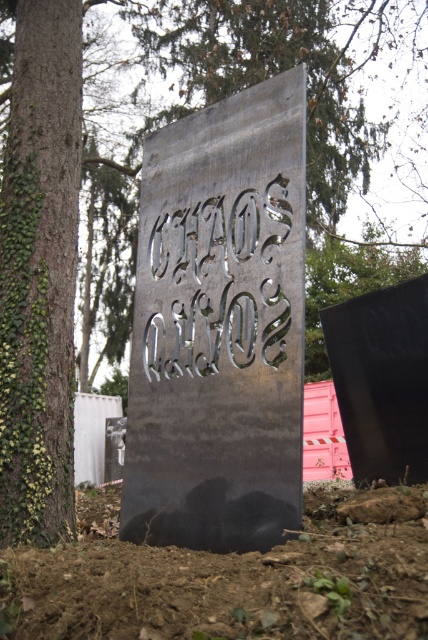
Question: Does metallic gray sign at center come behind brushed metal sign at center?

Choices:
 (A) yes
 (B) no

Answer: (B)

Question: Which object appears farthest from the camera in this image?

Choices:
 (A) brushed metal sign at center
 (B) metallic gray sign at center

Answer: (A)

Question: Which point is closer to the camera taking this photo?

Choices:
 (A) (183, 202)
 (B) (219, 250)

Answer: (B)

Question: Which point is closer to the camera?

Choices:
 (A) metallic gray sign at center
 (B) brushed metal sign at center

Answer: (A)

Question: Is metallic gray sign at center above brushed metal sign at center?

Choices:
 (A) no
 (B) yes

Answer: (A)

Question: Observing the image, what is the correct spatial positioning of metallic gray sign at center in reference to brushed metal sign at center?

Choices:
 (A) right
 (B) left

Answer: (B)